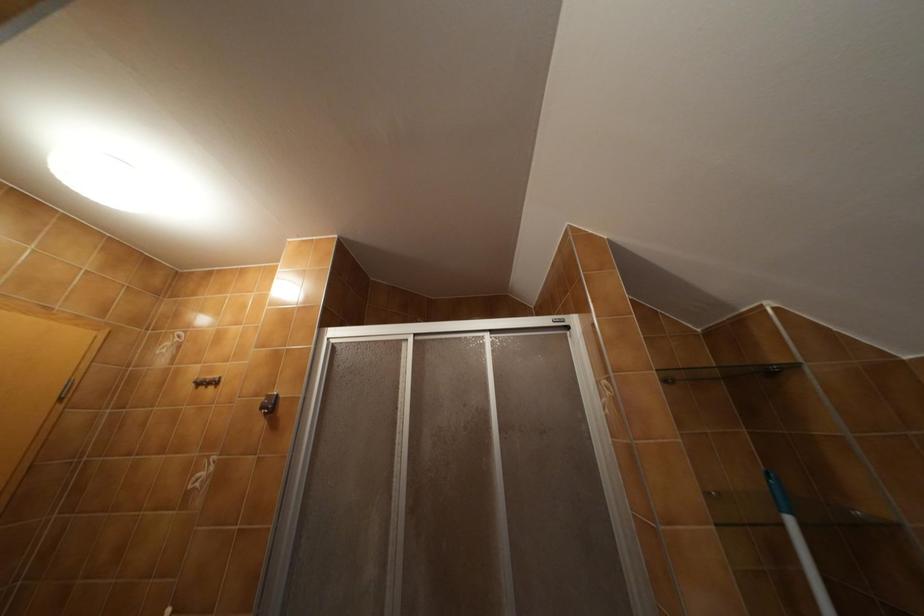
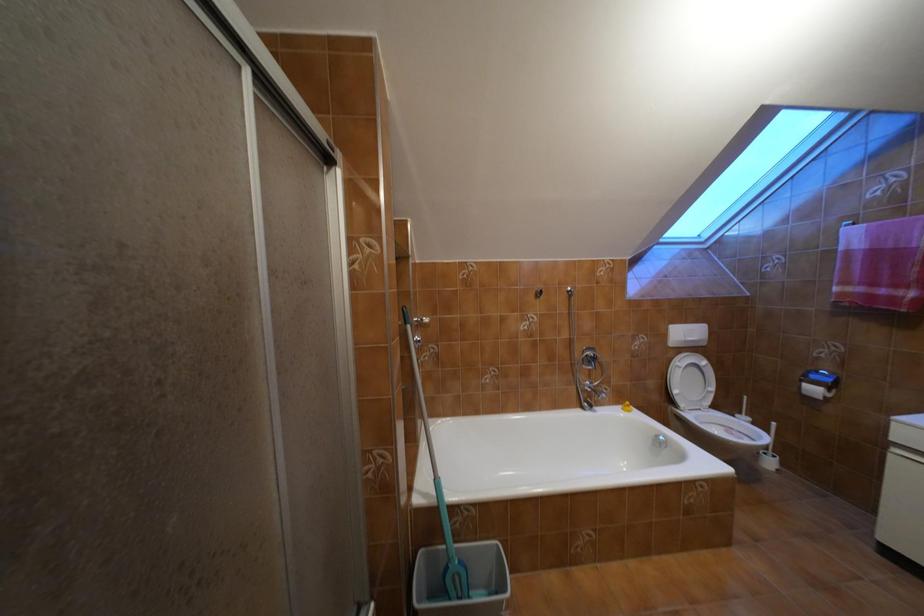
Question: The first image is from the beginning of the video and the second image is from the end. How did the camera likely rotate when shooting the video?

Choices:
 (A) Left
 (B) Right
 (C) Up
 (D) Down

Answer: (B)